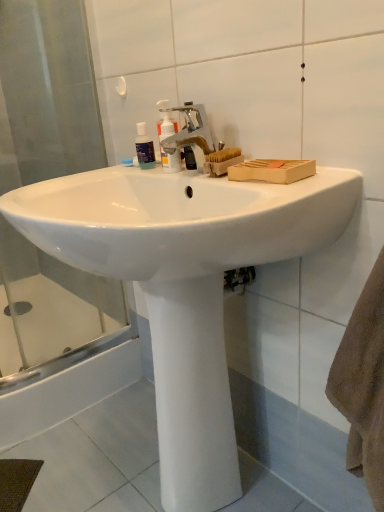
Find the location of a particular element. free region under transparent glass shower door at left (from a real-world perspective) is located at coordinates click(x=65, y=364).